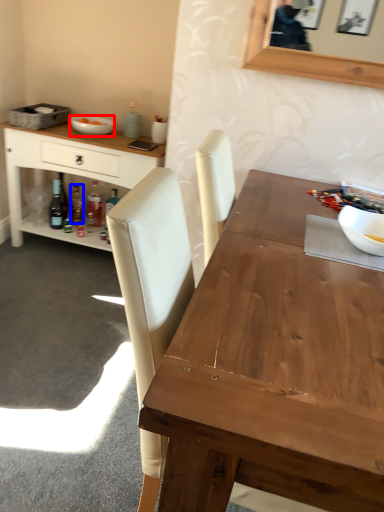
Question: Which object is closer to the camera taking this photo, bowl (highlighted by a red box) or bottle (highlighted by a blue box)?

Choices:
 (A) bowl
 (B) bottle

Answer: (A)